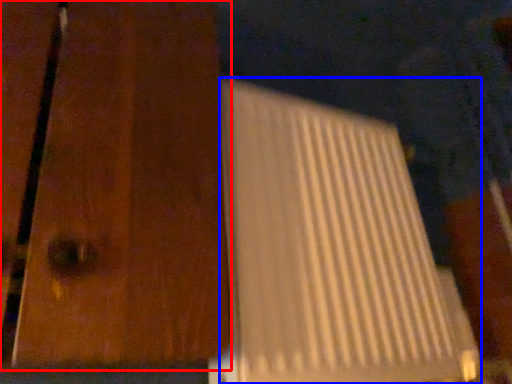
Question: Which object appears farthest to the camera in this image, door (highlighted by a red box) or wide (highlighted by a blue box)?

Choices:
 (A) door
 (B) wide

Answer: (B)